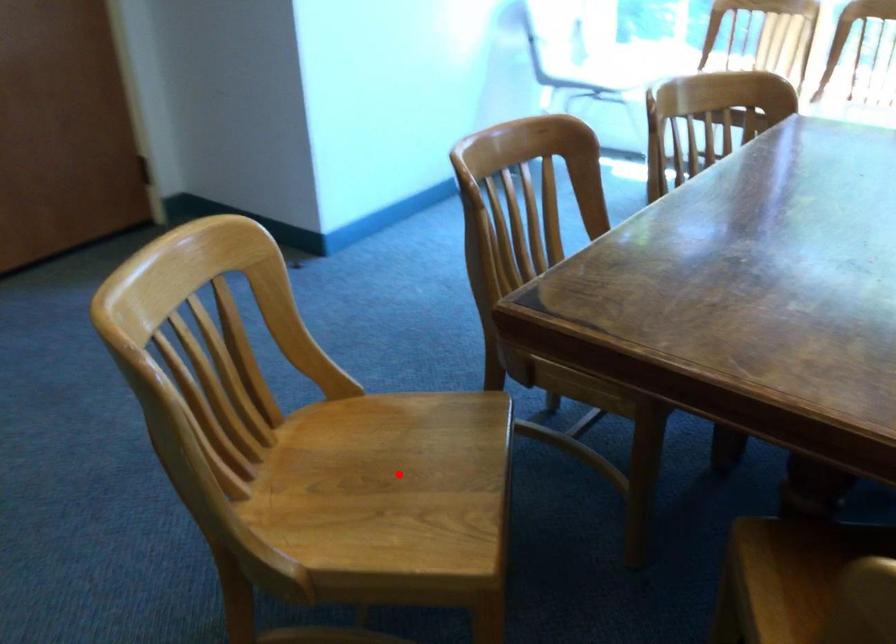
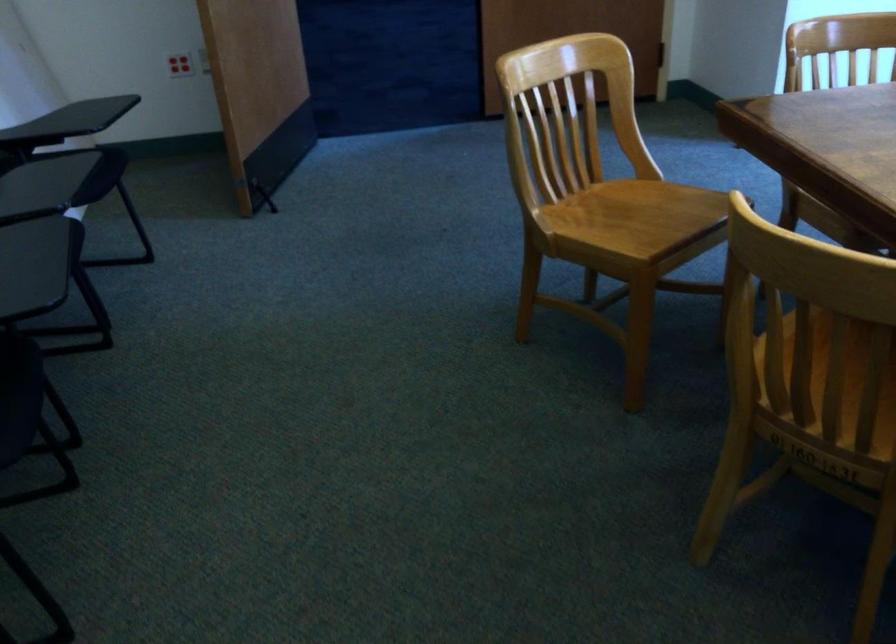
Question: I am providing you with two images of the same scene from different viewpoints. A red point is shown in image1. For the corresponding object point in image2, is it positioned nearer or farther from the camera?

Choices:
 (A) Nearer
 (B) Farther

Answer: (B)